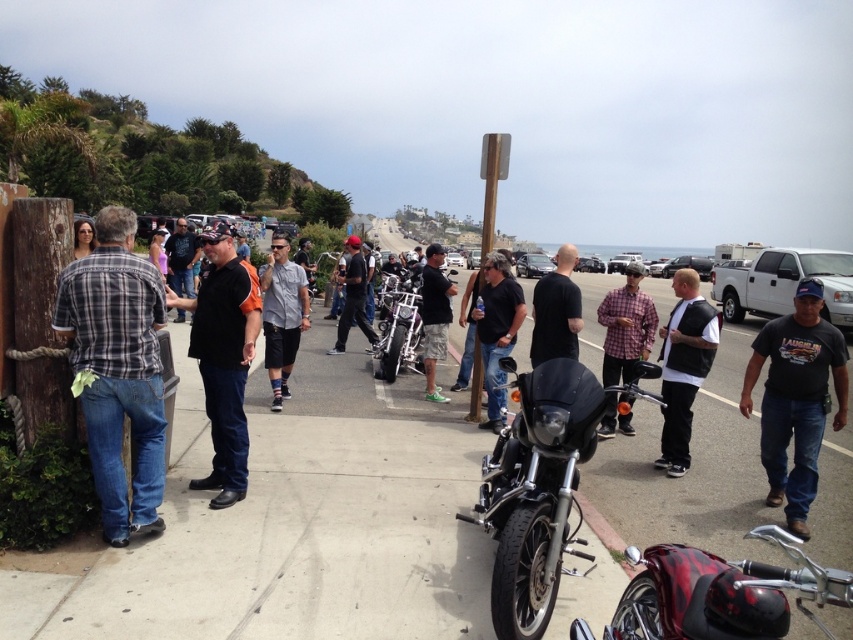
You are standing at the point marked as point [683,365] in the image. What object is located exactly at your current position?

The white matte vest at center is located exactly at point [683,365].

You are standing at the center of the image and want to place a small flag exactly at the concrete at center. What are the coordinates where you should place the flag?

The coordinates for the concrete at center are point (289, 524), so place the flag there.